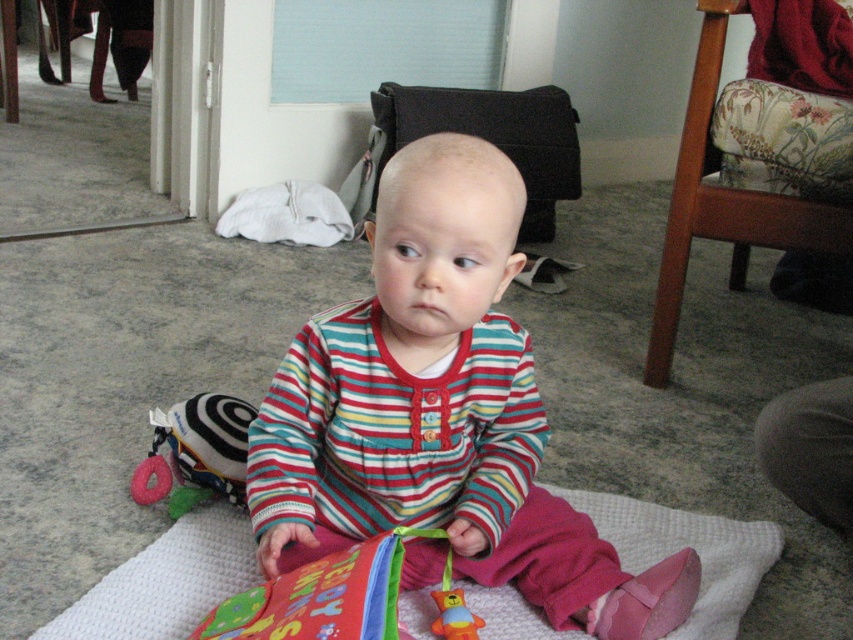
From the picture: You are a parent trying to clean up toys. You see the soft plush toy at lower left and the rubber duck toy at center. Which toy is covering the other one?

The soft plush toy at lower left is positioned over the rubber duck toy at center, so it is covering the rubber duck toy at center.

Based on the photo, you are a parent holding a baby who is sitting on a light colored mat. You want to hand them the black and white toy with pink ring attached to it. The baby is currently at point (193, 493). If the black and white toy with pink ring attached to it is 1.21 meters away from the baby, can the baby reach it?

The black and white toy with pink ring attached to it is 1.21 meters away from the baby at point (193, 493). Since the average reach of a baby is about 0.5 meters, the baby cannot reach the toy which is 1.21 meters away.

You are taking a photo of the baby and need to focus on two specific points in the image. The points are labeled as point [415,454] and point [466,634]. Which point is closer to the camera?

Point [415,454] is further to the camera than point [466,634], so the point closer to the camera is point [466,634].